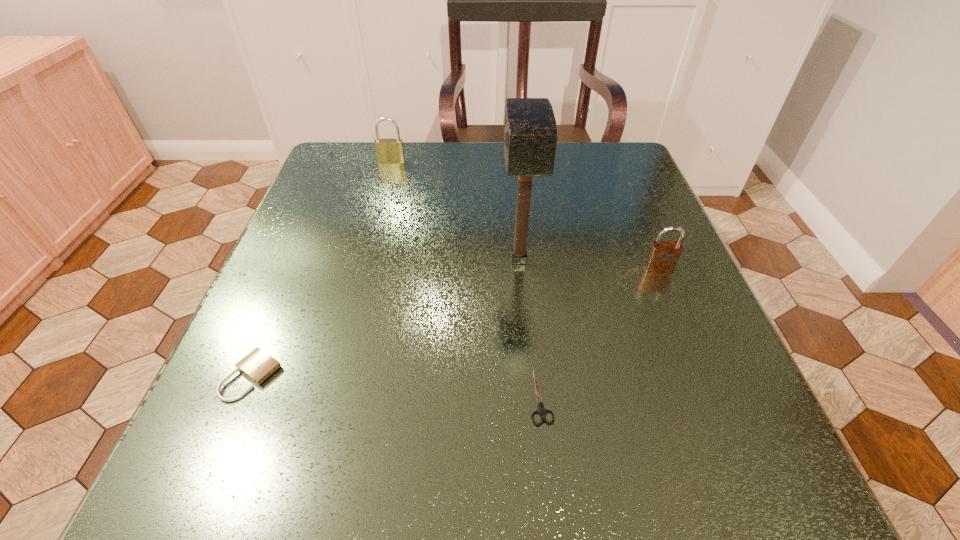
Image resolution: width=960 pixels, height=540 pixels. Find the location of `vacant space located on the front-facing side of the third shortest object`. vacant space located on the front-facing side of the third shortest object is located at coordinates (x=718, y=410).

Identify the location of vacant point located on the back of the shortest padlock. The width and height of the screenshot is (960, 540). (277, 315).

Find the location of a particular element. This screenshot has height=540, width=960. vacant space located on the left of the shears is located at coordinates (344, 396).

Locate an element on the screen. This screenshot has height=540, width=960. object positioned at the far edge is located at coordinates (390, 151).

In order to click on object that is at the right edge in this screenshot , I will do `click(663, 256)`.

Identify the location of object that is at the far left corner. The width and height of the screenshot is (960, 540). (390, 151).

In the image, there is a desktop. In order to click on vacant space at the far edge in this screenshot , I will do `click(542, 195)`.

This screenshot has height=540, width=960. Find the location of `free space at the near edge`. free space at the near edge is located at coordinates (645, 474).

Find the location of a particular element. The height and width of the screenshot is (540, 960). free point at the left edge is located at coordinates (348, 221).

This screenshot has height=540, width=960. I want to click on free space at the right edge of the desktop, so click(703, 394).